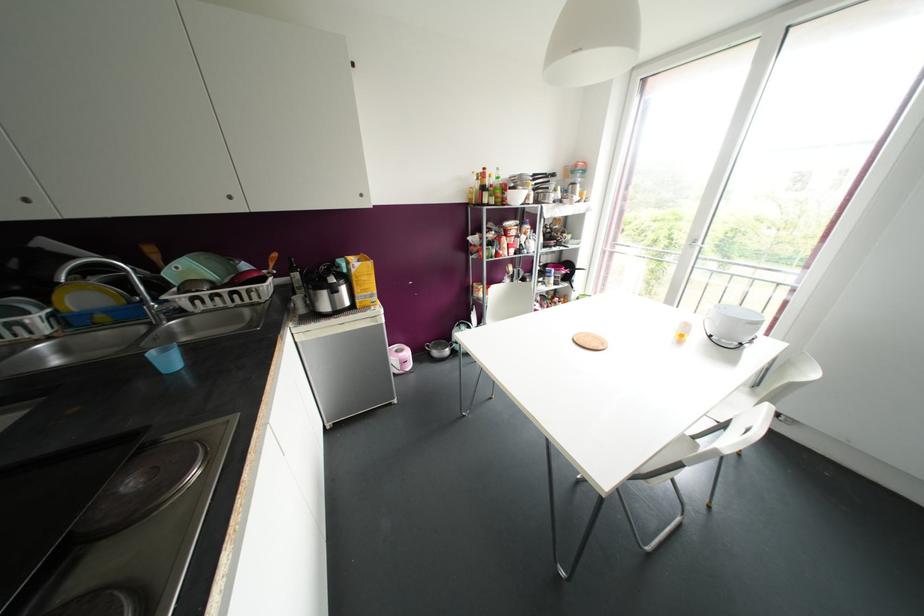
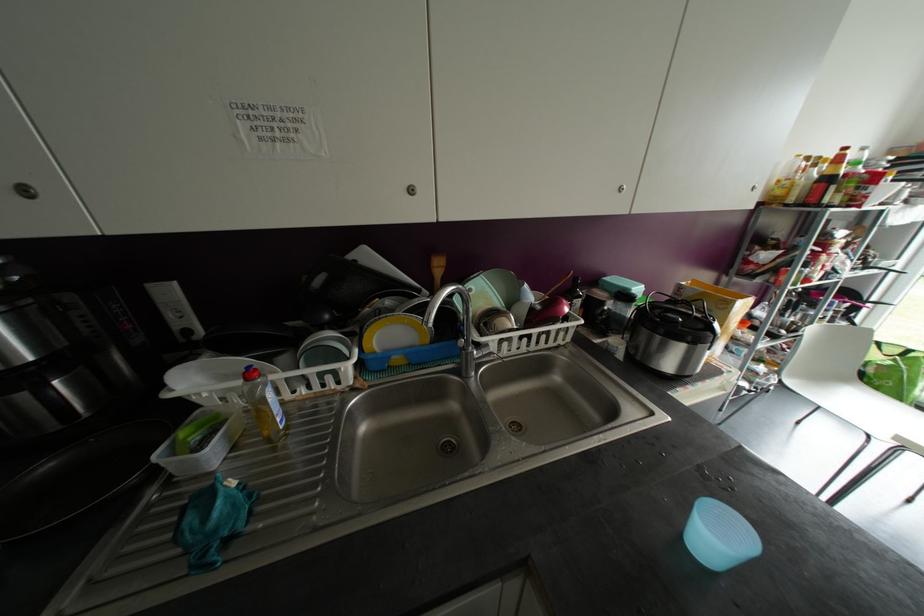
Question: The images are taken continuously from a first-person perspective. In which direction are you moving?

Choices:
 (A) Left
 (B) Right
 (C) Forward
 (D) Backward

Answer: (A)